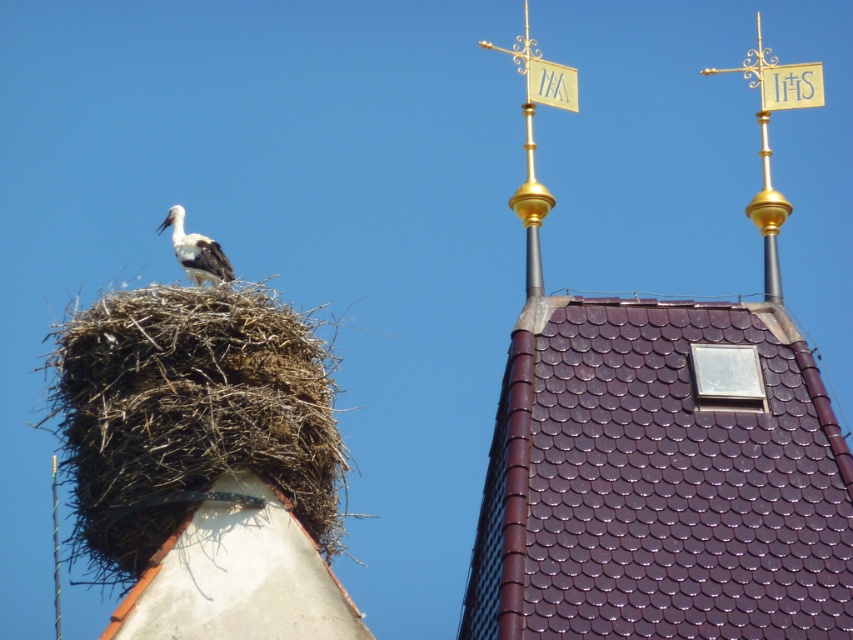
Question: Which of these objects is positioned farthest from the white matte stork at upper left?

Choices:
 (A) purple tile roof at upper center
 (B) brown textured nest at upper left
 (C) brown straw nest at upper left

Answer: (B)

Question: Which object is the farthest from the purple tile roof at upper center?

Choices:
 (A) white matte stork at upper left
 (B) brown textured nest at upper left

Answer: (A)

Question: Does purple tile roof at upper center appear on the right side of brown straw nest at upper left?

Choices:
 (A) no
 (B) yes

Answer: (B)

Question: Which of the following is the closest to the observer?

Choices:
 (A) click(x=224, y=317)
 (B) click(x=224, y=531)

Answer: (B)

Question: Observing the image, what is the correct spatial positioning of purple tile roof at upper center in reference to brown textured nest at upper left?

Choices:
 (A) right
 (B) left

Answer: (A)

Question: From the image, what is the correct spatial relationship of brown straw nest at upper left in relation to brown textured nest at upper left?

Choices:
 (A) left
 (B) right

Answer: (A)